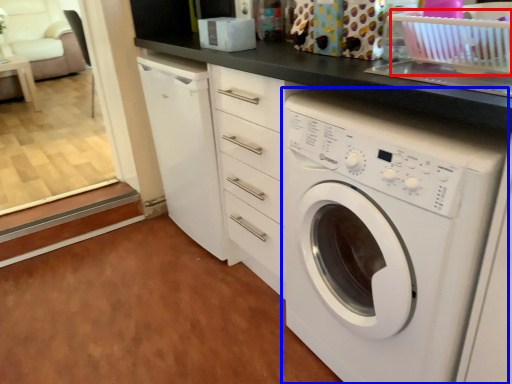
Question: Which object appears farthest to the camera in this image, basket (highlighted by a red box) or washing machine (highlighted by a blue box)?

Choices:
 (A) basket
 (B) washing machine

Answer: (A)